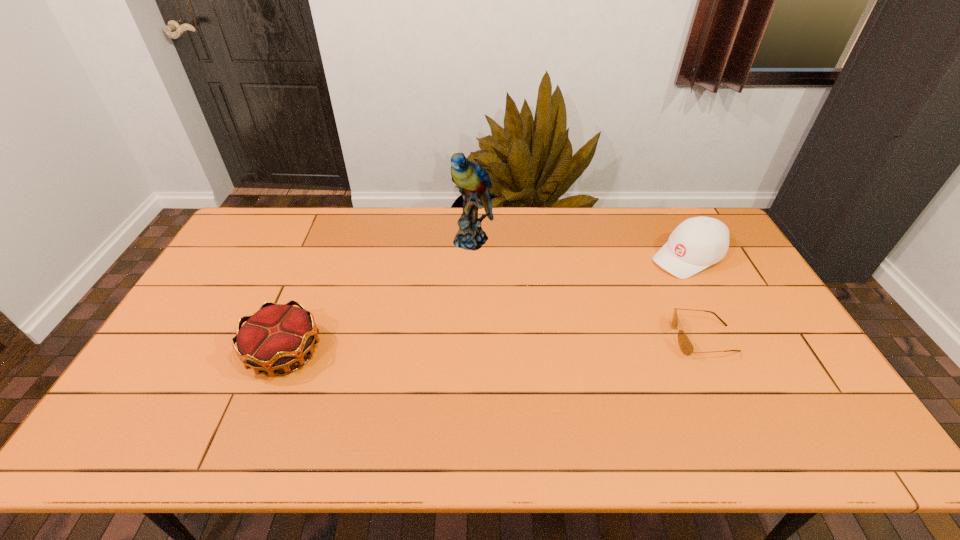
Locate an element on the screen. free space located 0.280m on the face of the tallest object is located at coordinates (449, 314).

This screenshot has width=960, height=540. Find the location of `free point located 0.200m on the face of the tallest object`. free point located 0.200m on the face of the tallest object is located at coordinates click(x=456, y=295).

What are the coordinates of `vacant area situated on the face of the tallest object` in the screenshot? It's located at (x=456, y=295).

The image size is (960, 540). I want to click on free space located 0.270m on the front-facing side of the baseball cap, so click(602, 301).

Locate an element on the screen. The height and width of the screenshot is (540, 960). vacant space located on the front-facing side of the baseball cap is located at coordinates [604, 300].

Where is `free region located on the front-facing side of the baseball cap`? This screenshot has height=540, width=960. free region located on the front-facing side of the baseball cap is located at coordinates (604, 300).

Find the location of a particular element. The width and height of the screenshot is (960, 540). parrot that is positioned at the far edge is located at coordinates (472, 180).

Locate an element on the screen. The width and height of the screenshot is (960, 540). baseball cap positioned at the far edge is located at coordinates (699, 242).

At what (x,y) coordinates should I click in order to perform the action: click on object at the near edge. Please return your answer as a coordinate pair (x, y). This screenshot has width=960, height=540. Looking at the image, I should click on (277, 336).

Locate an element on the screen. The height and width of the screenshot is (540, 960). sunglasses positioned at the right edge is located at coordinates coord(685,344).